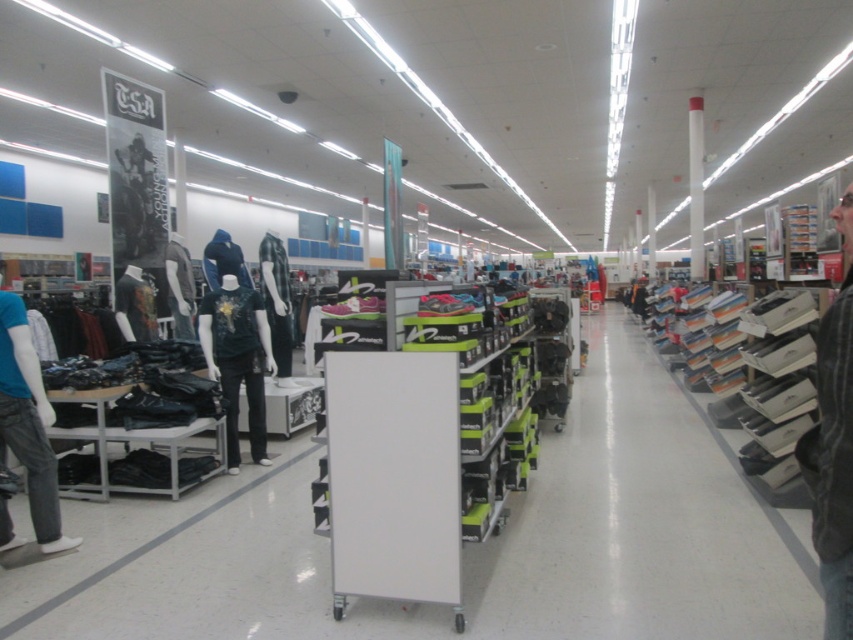
You are a customer in the store and want to see both the black leather jacket at right and the denim jeans at left. Which item is shorter in height?

The black leather jacket at right is shorter than the denim jeans at left.

You are a store employee organizing a promotional display. You have a black leather jacket at right and denim jeans at left. The display requires items to be arranged from widest to narrowest. Which item should you place first?

The black leather jacket at right should be placed first since it is wider than the denim jeans at left.

You are a customer in the store and want to find the shortest path between the two points marked as point (22, 456) and point (221, 385). Since you can walk freely in the store, which point should you approach first to reach the other?

Point (22, 456) is in front of point (221, 385), so you should approach point (22, 456) first to reach point (221, 385) since it is closer to your starting position.